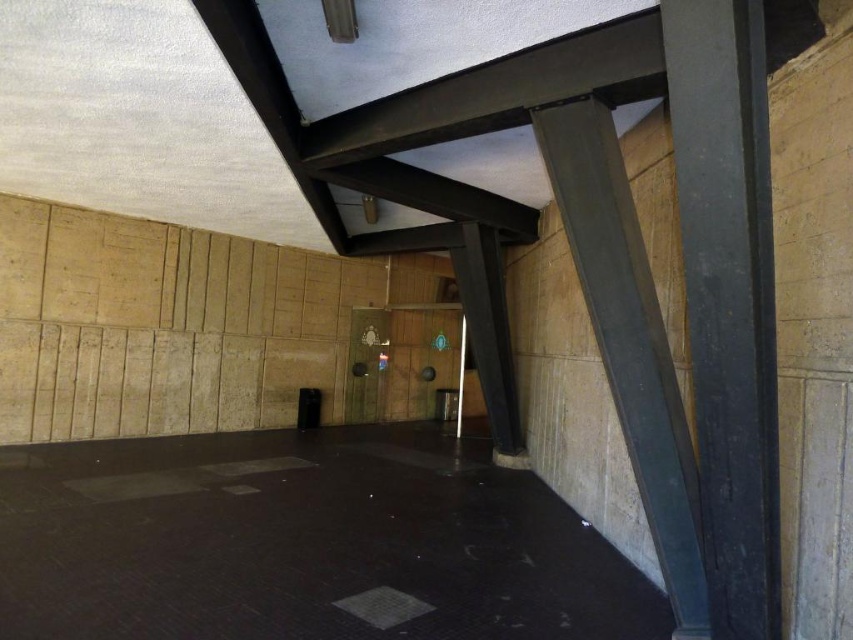
Is point (329, 636) closer to viewer compared to point (599, 301)?

That is True.

Between black concrete floor at lower left and metallic gray beam at center, which one is positioned higher?

Positioned higher is metallic gray beam at center.

Which is in front, point (321, 625) or point (683, 554)?

Point (321, 625) is more forward.

Locate an element on the screen. This screenshot has width=853, height=640. black concrete floor at lower left is located at coordinates (302, 541).

Between point (759, 321) and point (578, 280), which one is positioned in front?

Point (759, 321) is in front.

Who is lower down, smooth gray steel beam at right or metallic gray beam at center?

Positioned lower is smooth gray steel beam at right.

This screenshot has height=640, width=853. Describe the element at coordinates (728, 298) in the screenshot. I see `smooth gray steel beam at right` at that location.

The height and width of the screenshot is (640, 853). Find the location of `smooth gray steel beam at right`. smooth gray steel beam at right is located at coordinates pos(728,298).

Between black concrete floor at lower left and smooth gray steel beam at right, which one appears on the right side from the viewer's perspective?

smooth gray steel beam at right is more to the right.

Measure the distance from black concrete floor at lower left to smooth gray steel beam at right.

They are 3.11 meters apart.

Is point (61, 449) closer to camera compared to point (775, 516)?

No.

In order to click on black concrete floor at lower left in this screenshot , I will do `click(302, 541)`.